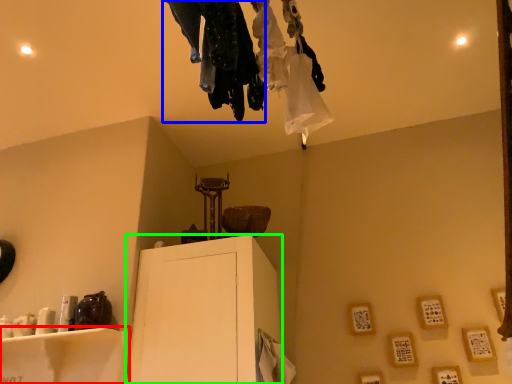
Question: Which is farther away from furniture (highlighted by a red box)? clothing (highlighted by a blue box) or furniture (highlighted by a green box)?

Choices:
 (A) clothing
 (B) furniture

Answer: (A)